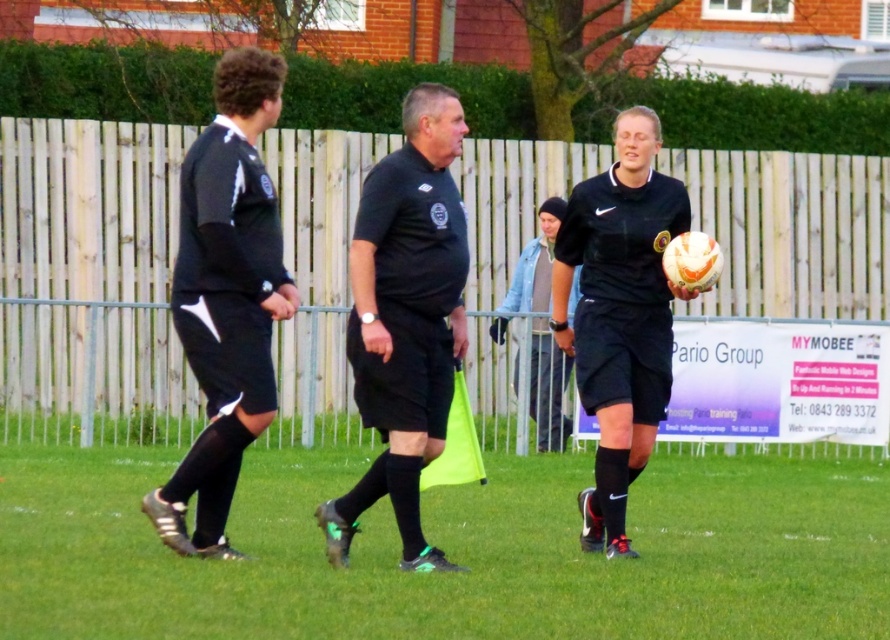
You are a soccer coach standing at the point with coordinates point [309,632] and want to pass the ball to a player positioned at point [595,532]. Will the pass travel towards the player or away from them?

The pass from point [309,632] to point [595,532] will travel towards the player positioned at point [595,532] because point [309,632] is in front of point [595,532].

Looking at this image, you are a photographer setting up for a soccer team photo. You notice the matte black uniform at center and the denim jacket at center. Which object should you focus on first if you want to capture the taller one?

The matte black uniform at center is taller than the denim jacket at center, so you should focus on the matte black uniform at center first.